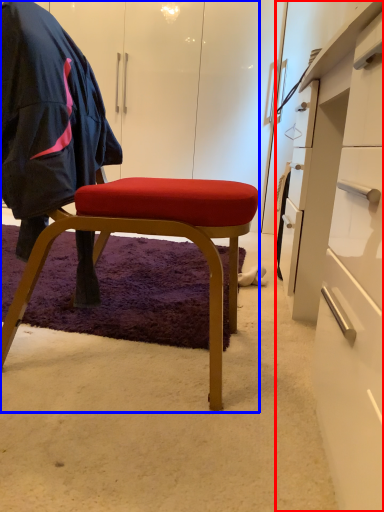
Question: Among these objects, which one is farthest to the camera, desk (highlighted by a red box) or chair (highlighted by a blue box)?

Choices:
 (A) desk
 (B) chair

Answer: (B)